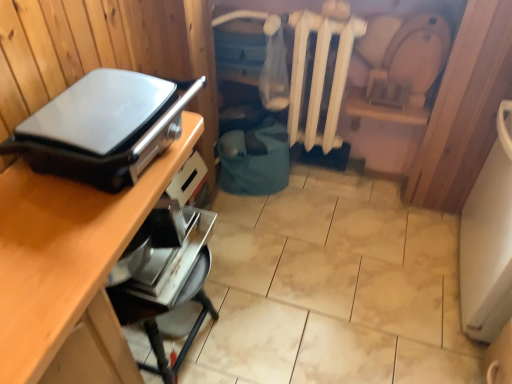
This screenshot has width=512, height=384. I want to click on vacant point above wooden desk at upper left (from a real-world perspective), so click(83, 218).